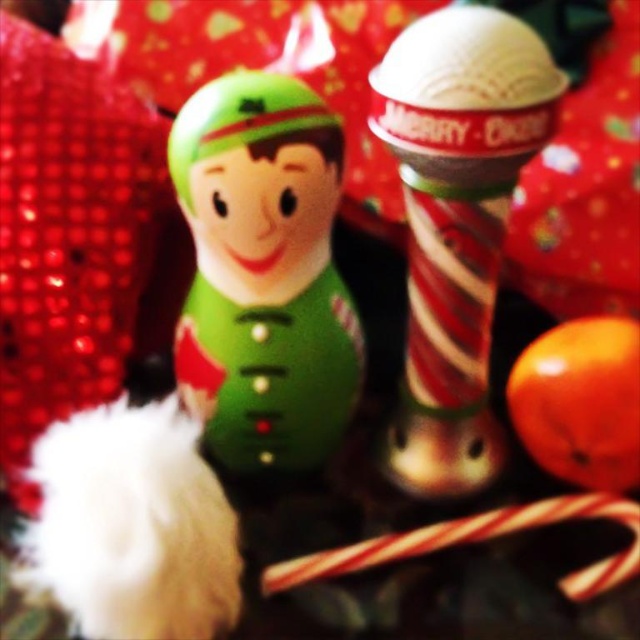
Is matte green plush at center thinner than shiny red and white striped candy cane at center?

No.

Who is lower down, matte green plush at center or shiny red and white striped candy cane at center?

matte green plush at center is below.

Is point (237, 257) closer to viewer compared to point (412, 28)?

That is True.

Find the location of `matte green plush at center`. matte green plush at center is located at coordinates (262, 273).

Is matte green plush at center smaller than white striped candy cane at lower center?

Actually, matte green plush at center might be larger than white striped candy cane at lower center.

Is matte green plush at center positioned before white striped candy cane at lower center?

Yes, it is.

The height and width of the screenshot is (640, 640). What do you see at coordinates (262, 273) in the screenshot? I see `matte green plush at center` at bounding box center [262, 273].

Where is `matte green plush at center`? The image size is (640, 640). matte green plush at center is located at coordinates (x=262, y=273).

Does point (470, 337) come behind point (384, 548)?

Yes.

Does shiny red and white striped candy cane at center appear on the right side of white striped candy cane at lower center?

Incorrect, shiny red and white striped candy cane at center is not on the right side of white striped candy cane at lower center.

Is point (419, 266) farther from camera compared to point (589, 566)?

No, (419, 266) is closer to viewer.

The height and width of the screenshot is (640, 640). In order to click on shiny red and white striped candy cane at center in this screenshot , I will do `click(456, 224)`.